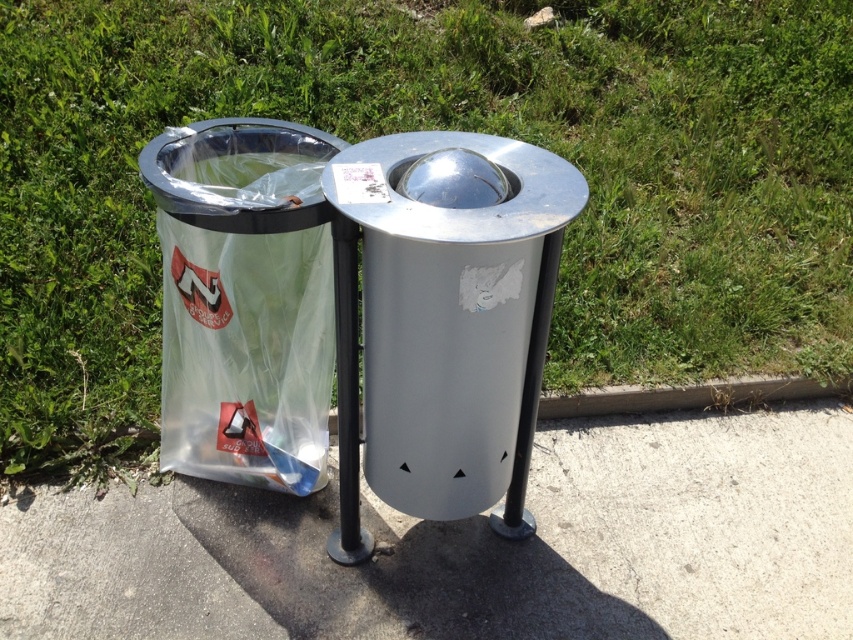
Does gray concrete pavement at lower center have a lesser width compared to clear plastic bag at left?

In fact, gray concrete pavement at lower center might be wider than clear plastic bag at left.

Does gray concrete pavement at lower center have a larger size compared to clear plastic bag at left?

Yes, gray concrete pavement at lower center is bigger than clear plastic bag at left.

Is point (700, 620) farther from camera compared to point (225, 193)?

Yes, it is.

At what (x,y) coordinates should I click in order to perform the action: click on gray concrete pavement at lower center. Please return your answer as a coordinate pair (x, y). This screenshot has height=640, width=853. Looking at the image, I should click on (473, 547).